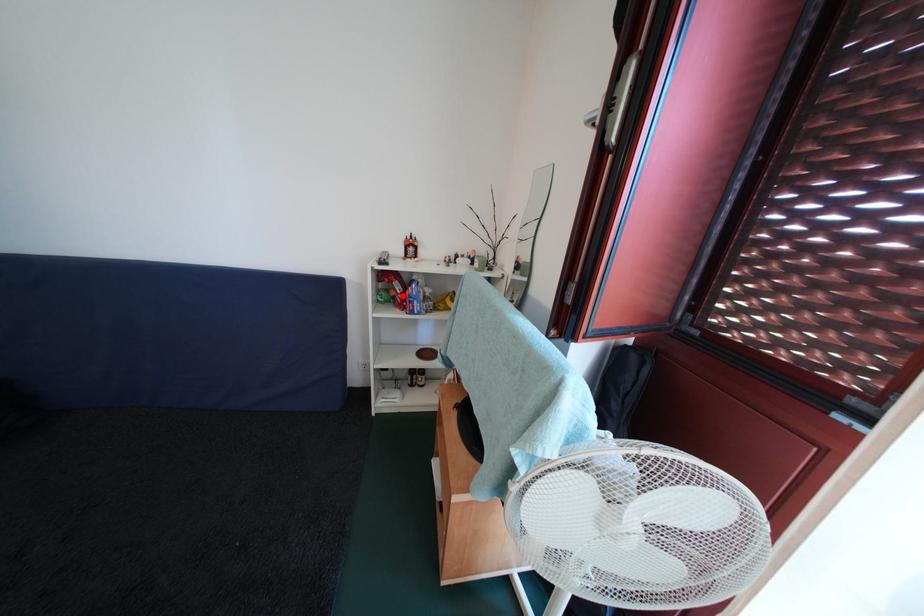
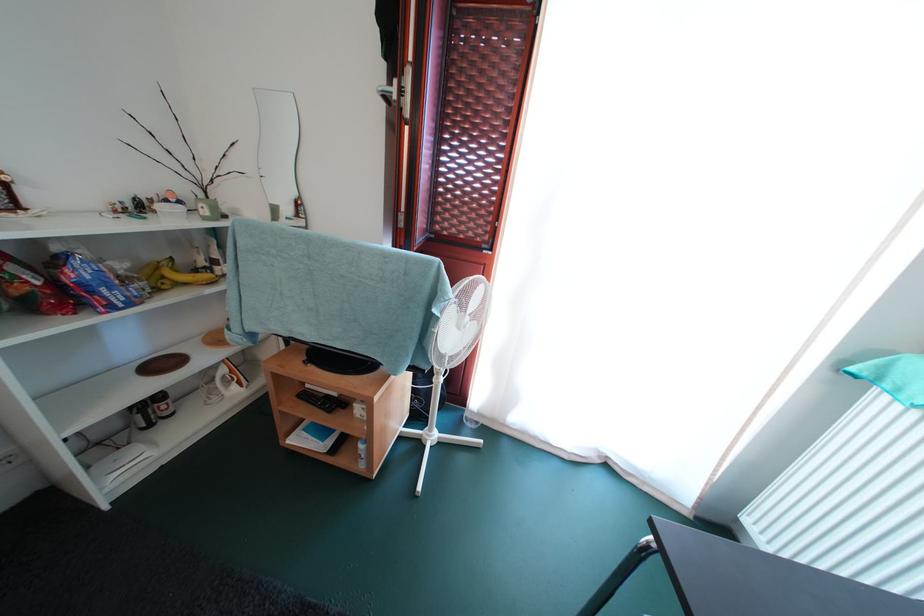
Question: I am providing you with two images of the same scene from different viewpoints. A red point is marked on the first image. Is the red point's position out of view in image 2?

Choices:
 (A) Yes
 (B) No

Answer: (B)